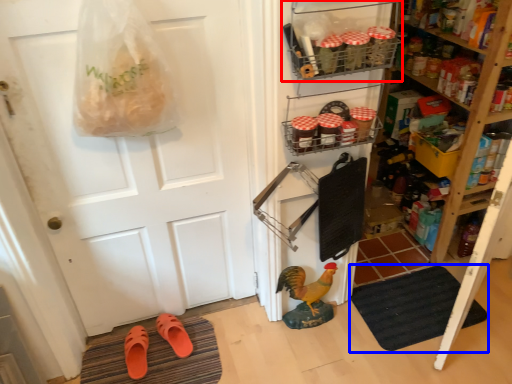
Question: Which of the following is the farthest to the observer, shelf (highlighted by a red box) or doormat (highlighted by a blue box)?

Choices:
 (A) shelf
 (B) doormat

Answer: (B)